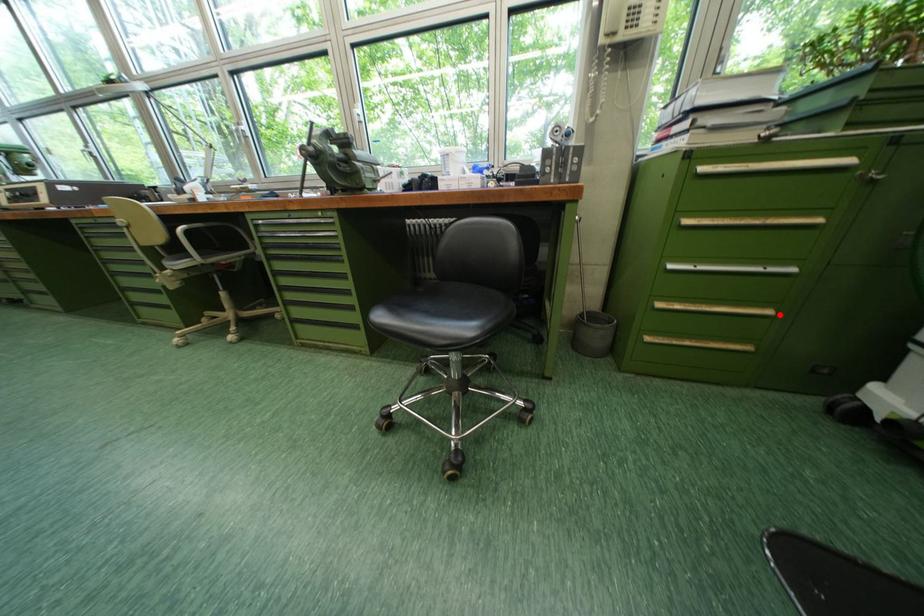
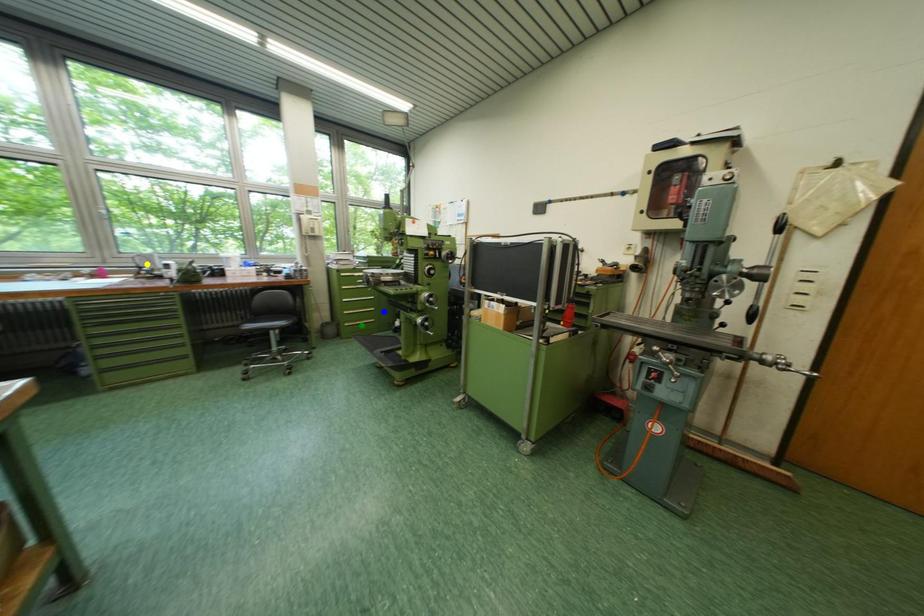
Question: I am providing you with two images of the same scene from different viewpoints. A red point is marked on the first image. You are given multiple points on the second image. Which mark in image 2 goes with the point in image 1?

Choices:
 (A) blue point
 (B) green point
 (C) yellow point

Answer: (A)